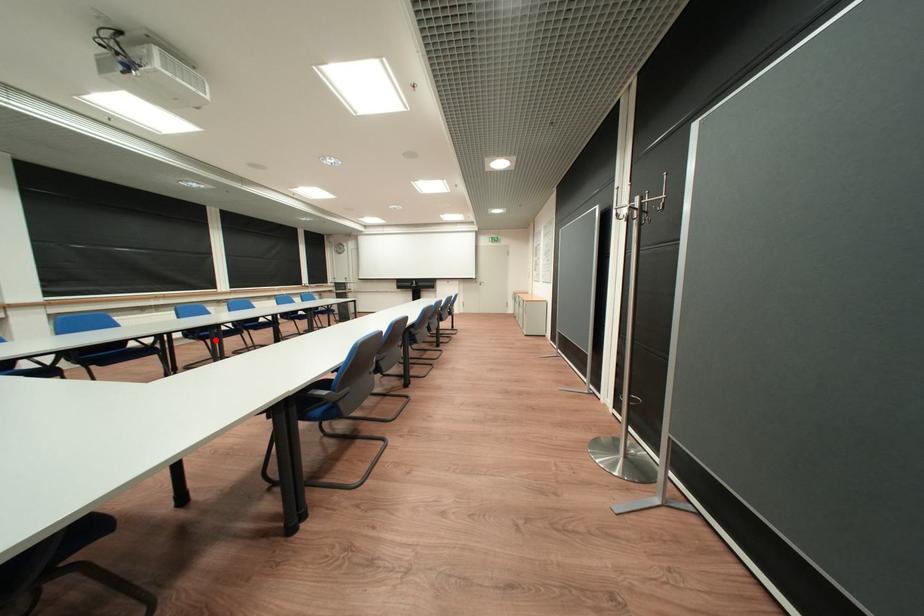
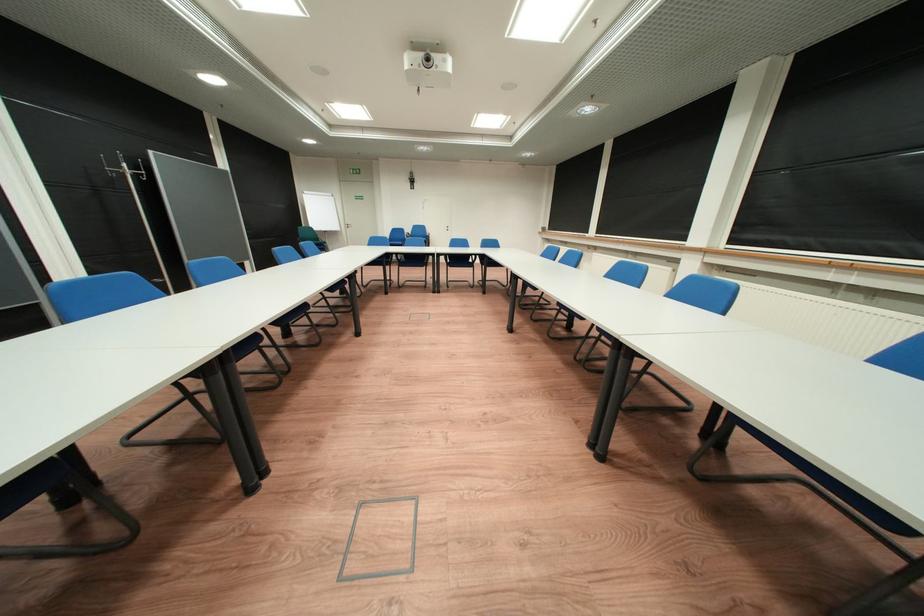
Question: I am providing you with two images of the same scene from different viewpoints. A red point is marked on the first image. Is the red point's position out of view in image 2?

Choices:
 (A) Yes
 (B) No

Answer: (A)